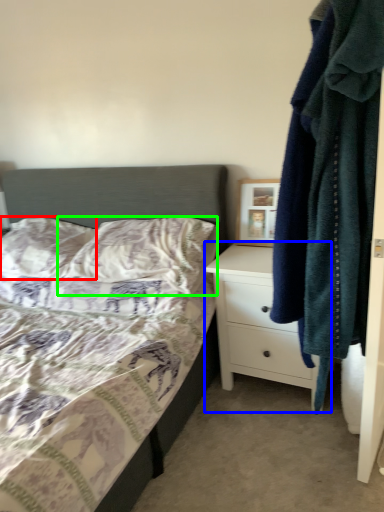
Question: Which object is positioned closest to pillow (highlighted by a red box)? Select from chest of drawers (highlighted by a blue box) and pillow (highlighted by a green box).

Choices:
 (A) chest of drawers
 (B) pillow

Answer: (B)